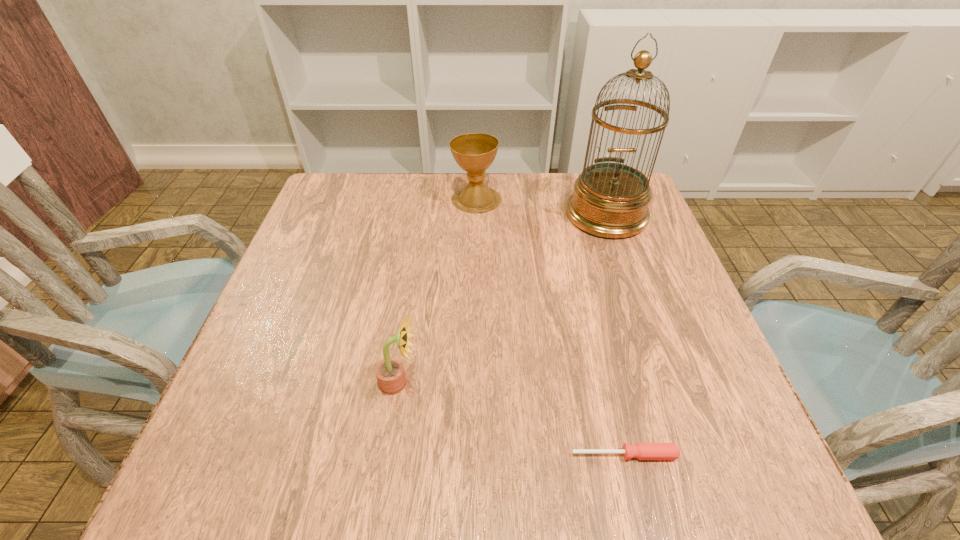
In the image, there is a desktop. Find the location of `free space at the right edge`. free space at the right edge is located at coordinates (727, 436).

This screenshot has height=540, width=960. In order to click on empty space that is in between the third farthest object and the tallest object in this screenshot , I will do `click(503, 299)`.

Where is `unoccupied area between the chalice and the birdcage`? unoccupied area between the chalice and the birdcage is located at coordinates (541, 207).

Locate an element on the screen. Image resolution: width=960 pixels, height=540 pixels. free space between the third object from right to left and the birdcage is located at coordinates (541, 207).

Locate an element on the screen. The width and height of the screenshot is (960, 540). free space between the sunflower and the second object from left to right is located at coordinates (438, 291).

At what (x,y) coordinates should I click in order to perform the action: click on free spot between the leftmost object and the third object from right to left. Please return your answer as a coordinate pair (x, y). Looking at the image, I should click on (438, 291).

Where is `free space between the shortest object and the chalice`? free space between the shortest object and the chalice is located at coordinates (550, 327).

You are a GUI agent. You are given a task and a screenshot of the screen. Output one action in this format:
    pyautogui.click(x=<x>, y=<y>)
    Task: Click on the free space between the second object from left to right and the tallest object
    The width and height of the screenshot is (960, 540).
    Given the screenshot: What is the action you would take?
    pyautogui.click(x=541, y=207)

I want to click on unoccupied area between the leftmost object and the screwdriver, so click(512, 419).

You are a GUI agent. You are given a task and a screenshot of the screen. Output one action in this format:
    pyautogui.click(x=<x>, y=<y>)
    Task: Click on the free space that is in between the tallest object and the shortest object
    
    Given the screenshot: What is the action you would take?
    [615, 335]